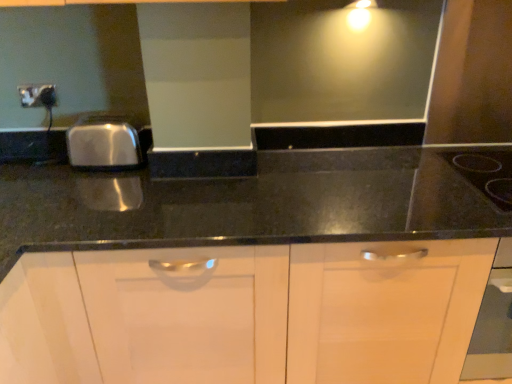
Question: From a real-world perspective, is black glass gas stove at upper right positioned above or below matte black outlet at upper left?

Choices:
 (A) above
 (B) below

Answer: (B)

Question: Looking at the image, does black glass gas stove at upper right seem bigger or smaller compared to matte black outlet at upper left?

Choices:
 (A) small
 (B) big

Answer: (B)

Question: Considering the positions of black glass gas stove at upper right and matte black outlet at upper left in the image, is black glass gas stove at upper right taller or shorter than matte black outlet at upper left?

Choices:
 (A) tall
 (B) short

Answer: (B)

Question: Is matte black outlet at upper left to the left or to the right of black glass gas stove at upper right in the image?

Choices:
 (A) left
 (B) right

Answer: (A)

Question: In terms of height, does matte black outlet at upper left look taller or shorter compared to black glass gas stove at upper right?

Choices:
 (A) tall
 (B) short

Answer: (A)

Question: From a real-world perspective, is matte black outlet at upper left above or below black glass gas stove at upper right?

Choices:
 (A) above
 (B) below

Answer: (A)

Question: Does point (23, 92) appear closer or farther from the camera than point (481, 165)?

Choices:
 (A) farther
 (B) closer

Answer: (A)